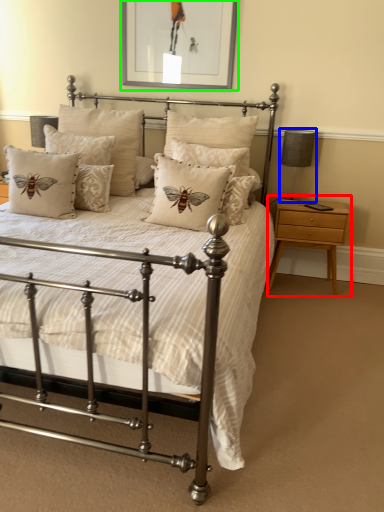
Question: Considering the real-world distances, which object is farthest from nightstand (highlighted by a red box)? table lamp (highlighted by a blue box) or picture frame (highlighted by a green box)?

Choices:
 (A) table lamp
 (B) picture frame

Answer: (B)